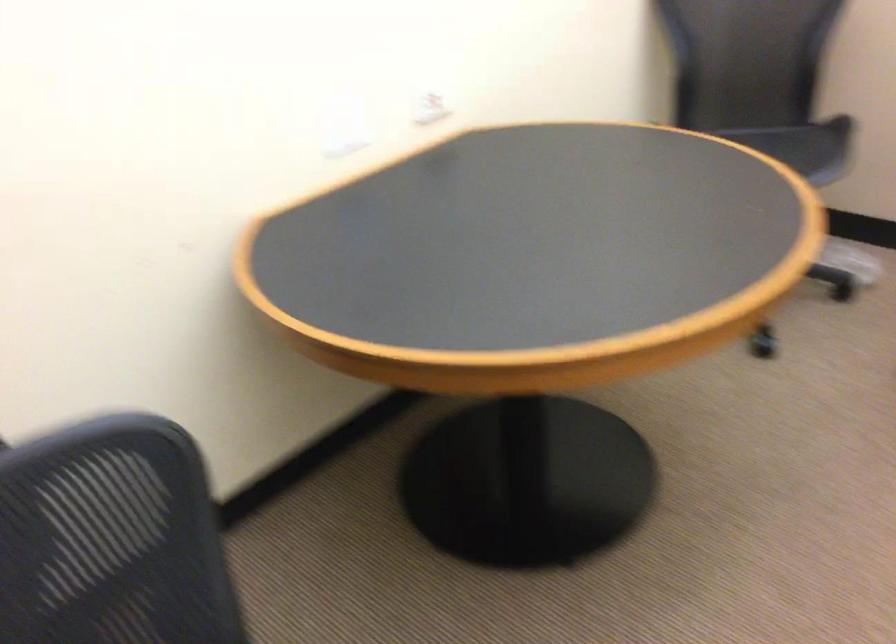
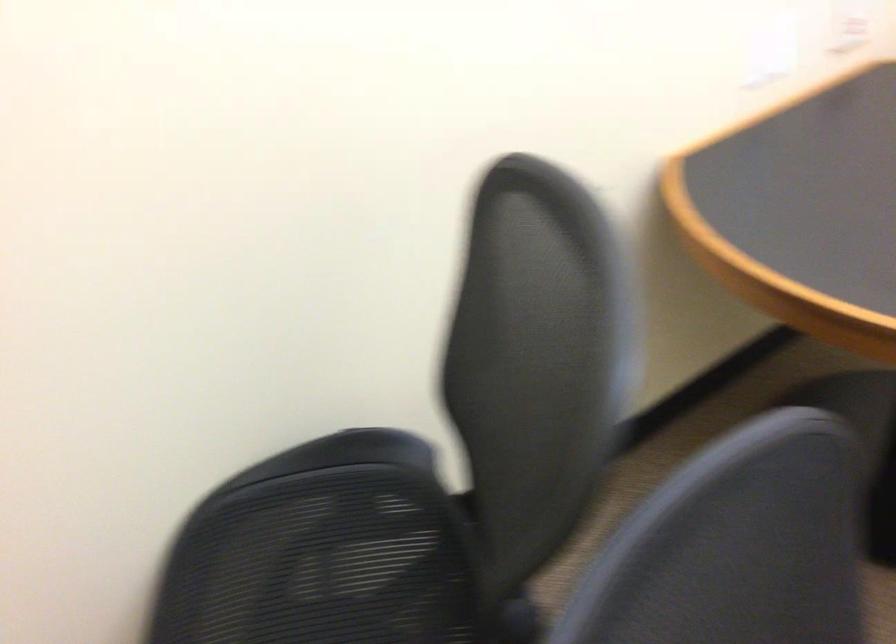
In the second image, find the point that corresponds to the point at 363,239 in the first image.

(812, 190)